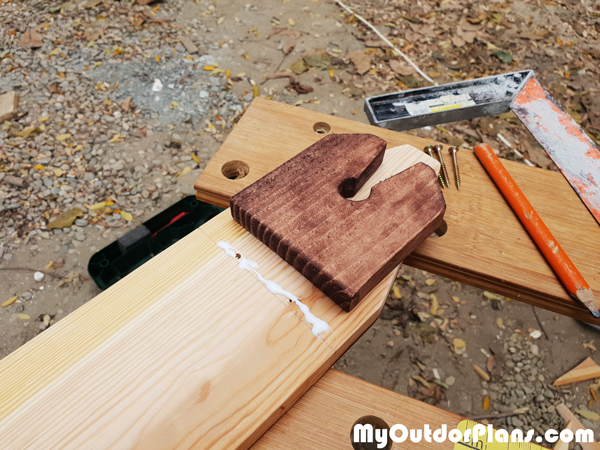
You are a GUI agent. You are given a task and a screenshot of the screen. Output one action in this format:
    pyautogui.click(x=<x>, y=<y>)
    Task: Click on the dark wood element
    The width and height of the screenshot is (600, 450).
    Given the screenshot: What is the action you would take?
    pyautogui.click(x=328, y=215)